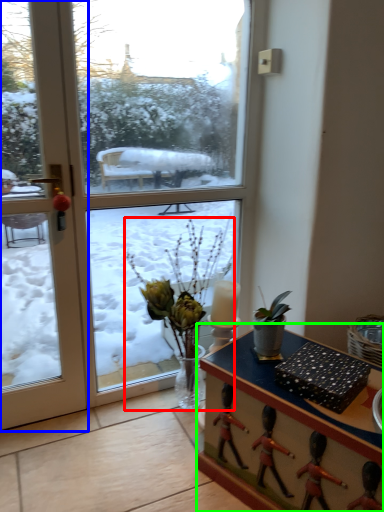
Question: Based on their relative distances, which object is farther from houseplant (highlighted by a red box)? Choose from door (highlighted by a blue box) and desk (highlighted by a green box).

Choices:
 (A) door
 (B) desk

Answer: (A)